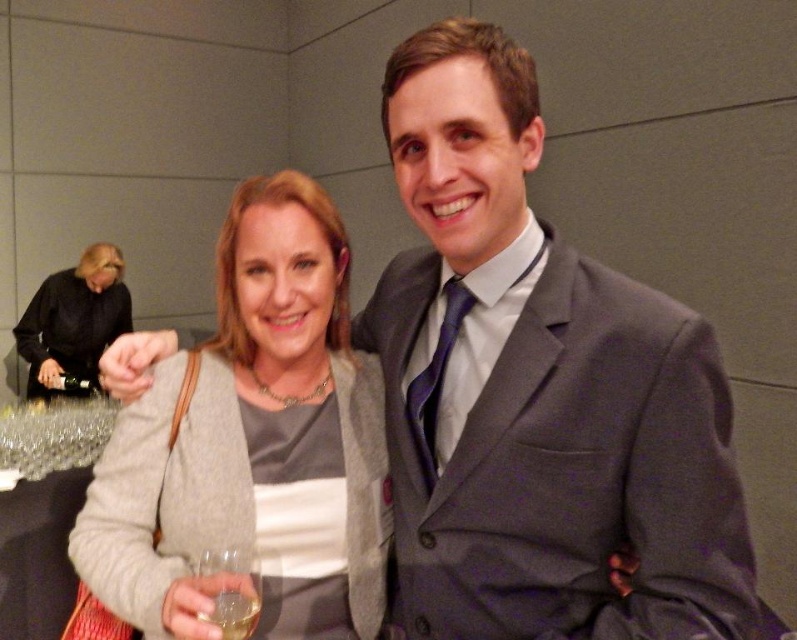
You are organizing a charity event and need to arrange two items on a table. You have a matte gray sweater at center and a black leather jacket at upper left. Given their sizes, which item should you place on the left side of the table to ensure there is enough space for both items without overlapping?

The matte gray sweater at center is narrower than the black leather jacket at upper left. To ensure enough space without overlapping, place the matte gray sweater at center on the left side since it takes up less space.

You are a photographer setting up for a group photo. You notice the matte gray sweater at center and the black leather jacket at upper left in the frame. Which object should you adjust to ensure both are fully visible in the photo?

The matte gray sweater at center is not as tall as the black leather jacket at upper left. To ensure both are fully visible, adjust the angle or position so that the shorter matte gray sweater at center is not blocked by the taller black leather jacket at upper left.